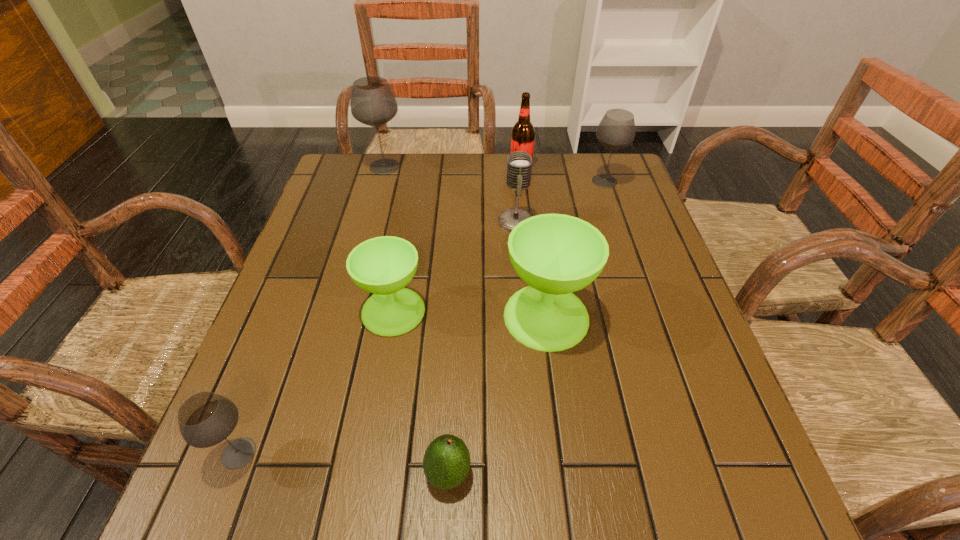
Identify the location of the leftmost object. (205, 419).

Where is `the nearest gray wineglass`? The image size is (960, 540). the nearest gray wineglass is located at coordinates (205, 419).

The image size is (960, 540). Find the location of `the fifth object from right to left`. the fifth object from right to left is located at coordinates (446, 463).

Find the location of a particular element. The image size is (960, 540). the shortest object is located at coordinates (446, 463).

The width and height of the screenshot is (960, 540). I want to click on free space located 0.220m on the right of the second gray wineglass from left to right, so click(478, 167).

What are the coordinates of `vacant position located on the right of the root beer` in the screenshot? It's located at (585, 165).

Where is `free space located on the back of the rightmost gray wineglass`? The height and width of the screenshot is (540, 960). free space located on the back of the rightmost gray wineglass is located at coordinates (597, 159).

Find the location of a particular element. The image size is (960, 540). free region located 0.200m on the right of the bigger green wineglass is located at coordinates (683, 316).

In order to click on vacant area situated on the right of the gray microphone in this screenshot , I will do `click(612, 221)`.

In order to click on free location located on the back of the smaller green wineglass in this screenshot , I will do `click(403, 257)`.